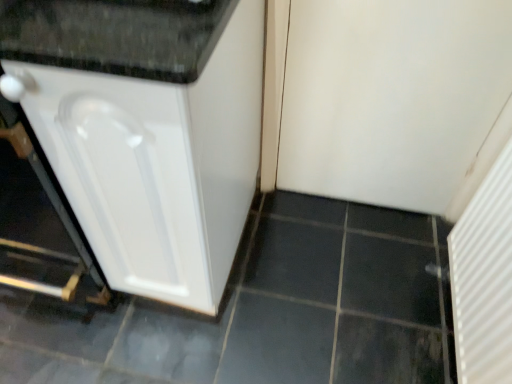
Question: From the image's perspective, relative to white textured radiator at right, the 2th screen door in the top-to-bottom sequence, is white matte door at upper right, arranged as the 2th screen door when ordered from the bottom, above or below?

Choices:
 (A) above
 (B) below

Answer: (A)

Question: Looking at the image, does white matte door at upper right, the first screen door positioned from the top, seem bigger or smaller compared to white textured radiator at right, the 1th screen door positioned from the bottom?

Choices:
 (A) big
 (B) small

Answer: (A)

Question: Which object is the farthest from the white matte door at upper right, arranged as the 2th screen door when ordered from the bottom?

Choices:
 (A) white textured radiator at right, the 1th screen door positioned from the bottom
 (B) white glossy cabinet at left

Answer: (B)

Question: Which object is positioned farthest from the white textured radiator at right, the 1th screen door positioned from the bottom?

Choices:
 (A) white matte door at upper right, arranged as the 2th screen door when ordered from the bottom
 (B) white glossy cabinet at left

Answer: (B)